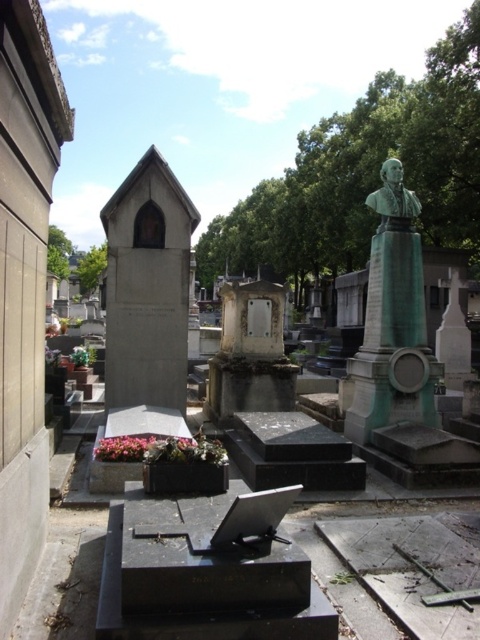
In the scene shown: You are standing in the cemetery and want to read the inscriptions on the white marble tombstone at center. Can you reach it without moving closer than your current position?

The white marble tombstone at center is 7.52 meters away from viewer, so you cannot reach it without moving closer than your current position.

You are a groundskeeper in the cemetery and need to water both the white marble tombstone at center and the green polished stone bust at center. Which one should you water first if you want to avoid getting water on the other?

The white marble tombstone at center is positioned under the green polished stone bust at center, so watering the lower one first would prevent water from dripping onto the upper one.